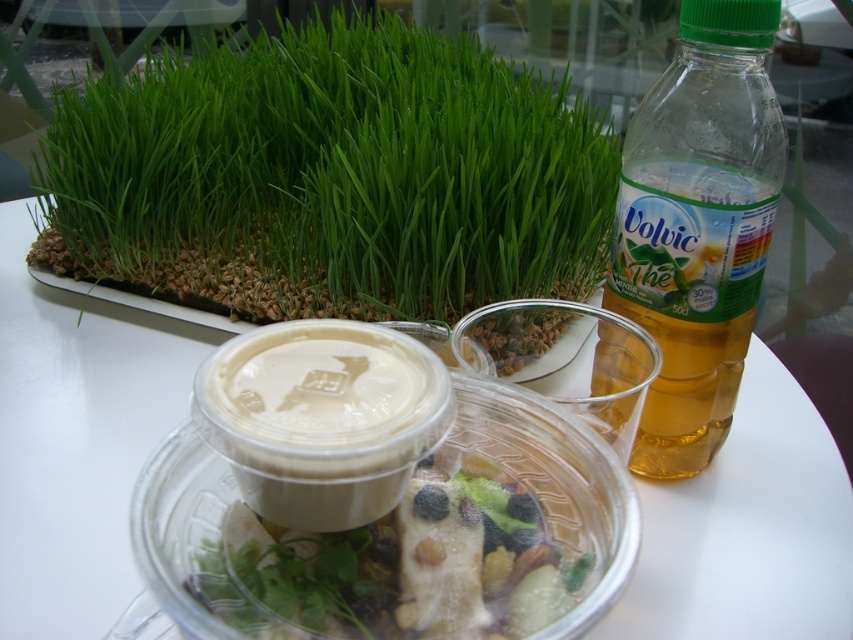
Who is lower down, green grass at upper left or translucent plastic salad at center?

translucent plastic salad at center

Can you confirm if green grass at upper left is positioned below translucent plastic salad at center?

No.

Which is in front, point (322, 180) or point (425, 518)?

Point (425, 518)

The image size is (853, 640). Find the location of `green grass at upper left`. green grass at upper left is located at coordinates (331, 177).

Is green grass at upper left below translucent plastic bottle at right?

Incorrect, green grass at upper left is not positioned below translucent plastic bottle at right.

Does green grass at upper left appear over translucent plastic bottle at right?

Indeed, green grass at upper left is positioned over translucent plastic bottle at right.

Between point (332, 230) and point (682, 285), which one is positioned behind?

The point (332, 230) is behind.

The width and height of the screenshot is (853, 640). Find the location of `green grass at upper left`. green grass at upper left is located at coordinates (331, 177).

Which is above, translucent plastic bottle at right or translucent plastic salad at center?

Positioned higher is translucent plastic bottle at right.

Who is positioned more to the left, translucent plastic bottle at right or translucent plastic salad at center?

From the viewer's perspective, translucent plastic salad at center appears more on the left side.

In order to click on translucent plastic bottle at right in this screenshot , I will do `click(698, 225)`.

Find the location of a particular element. The height and width of the screenshot is (640, 853). translucent plastic bottle at right is located at coordinates (698, 225).